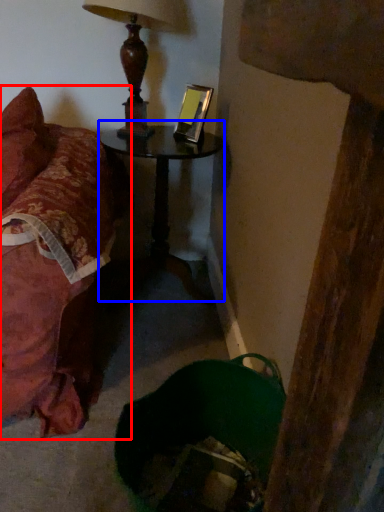
Question: Which object is further to the camera taking this photo, furniture (highlighted by a red box) or table (highlighted by a blue box)?

Choices:
 (A) furniture
 (B) table

Answer: (B)